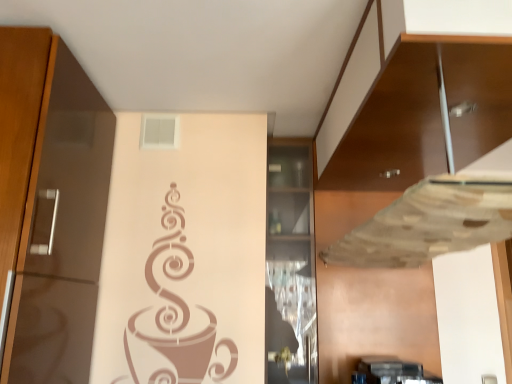
Question: Considering the positions of point (293, 193) and point (457, 150), is point (293, 193) closer or farther from the camera than point (457, 150)?

Choices:
 (A) closer
 (B) farther

Answer: (B)

Question: Is transparent glass cabinet at center, which appears as the 2th cabinetry when viewed from the right, in front of or behind matte brown cabinet at right, which is the 2th cabinetry from left to right, in the image?

Choices:
 (A) front
 (B) behind

Answer: (B)

Question: From the image's perspective, is transparent glass cabinet at center, the 1th cabinetry in the left-to-right sequence, positioned above or below matte brown cabinet at right, which is the 1th cabinetry from right to left?

Choices:
 (A) below
 (B) above

Answer: (A)

Question: From a real-world perspective, is matte brown cabinet at right, which is the 1th cabinetry from right to left, positioned above or below transparent glass cabinet at center, the 1th cabinetry in the left-to-right sequence?

Choices:
 (A) below
 (B) above

Answer: (B)

Question: Does point (352, 132) appear closer or farther from the camera than point (291, 354)?

Choices:
 (A) closer
 (B) farther

Answer: (A)

Question: Choose the correct answer: Is matte brown cabinet at right, which is the 2th cabinetry from left to right, inside transparent glass cabinet at center, which appears as the 2th cabinetry when viewed from the right, or outside it?

Choices:
 (A) outside
 (B) inside

Answer: (A)

Question: Is matte brown cabinet at right, which is the 1th cabinetry from right to left, wider or thinner than transparent glass cabinet at center, the 1th cabinetry in the left-to-right sequence?

Choices:
 (A) thin
 (B) wide

Answer: (B)